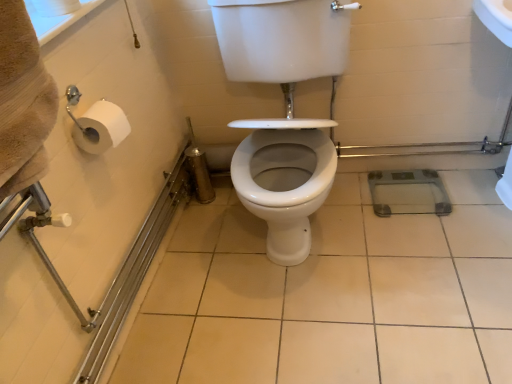
This screenshot has height=384, width=512. What are the coordinates of `vacant space underneath white glossy toilet seat at center (from a real-world perspective)` in the screenshot? It's located at (307, 258).